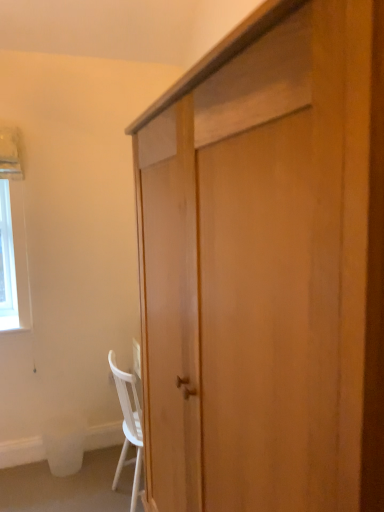
Identify the location of white plastic trash bin at lower left. (64, 444).

Where is `light wood cabinet at center`? light wood cabinet at center is located at coordinates (267, 268).

Image resolution: width=384 pixels, height=512 pixels. I want to click on white matte chair at lower left, so click(x=128, y=425).

Is white plastic trash bin at lower left completely or partially inside light wood cabinet at center?

No, white plastic trash bin at lower left is not surrounded by light wood cabinet at center.

Is light wood cabinet at center in contact with white plastic trash bin at lower left?

light wood cabinet at center and white plastic trash bin at lower left are not in contact.

Is light wood cabinet at center at the left side of white plastic trash bin at lower left?

In fact, light wood cabinet at center is to the right of white plastic trash bin at lower left.

From a real-world perspective, is light wood cabinet at center physically located above or below white plastic trash bin at lower left?

From a real-world perspective, light wood cabinet at center is physically above white plastic trash bin at lower left.

Are white matte chair at lower left and white plastic trash bin at lower left far apart?

No, there isn't a large distance between white matte chair at lower left and white plastic trash bin at lower left.

Considering the sizes of objects white matte chair at lower left and white plastic trash bin at lower left in the image provided, who is bigger, white matte chair at lower left or white plastic trash bin at lower left?

white matte chair at lower left is bigger.

From a real-world perspective, which object stands above the other?

white matte chair at lower left, from a real-world perspective.

In the scene shown: Considering their positions, is white matte chair at lower left located in front of or behind white plastic trash bin at lower left?

white matte chair at lower left is positioned closer to the viewer than white plastic trash bin at lower left.

From a real-world perspective, between white plastic trash bin at lower left and white matte chair at lower left, who is vertically lower?

white plastic trash bin at lower left is physically lower.

Based on the photo, does white plastic trash bin at lower left appear on the right side of white matte chair at lower left?

Incorrect, white plastic trash bin at lower left is not on the right side of white matte chair at lower left.

Could white matte chair at lower left be considered to be inside white plastic trash bin at lower left?

No, white matte chair at lower left is located outside of white plastic trash bin at lower left.

Considering the sizes of objects white plastic trash bin at lower left and white matte chair at lower left in the image provided, who is wider, white plastic trash bin at lower left or white matte chair at lower left?

Wider between the two is white plastic trash bin at lower left.

Which of these two, white matte chair at lower left or light wood cabinet at center, stands taller?

light wood cabinet at center.

Could you tell me if white matte chair at lower left is facing light wood cabinet at center?

No, white matte chair at lower left is not aimed at light wood cabinet at center.

Which object is closer to the camera, white matte chair at lower left or light wood cabinet at center?

light wood cabinet at center.

Considering the sizes of objects light wood cabinet at center and white matte chair at lower left in the image provided, who is bigger, light wood cabinet at center or white matte chair at lower left?

light wood cabinet at center.

This screenshot has height=512, width=384. In the image, there is a white matte chair at lower left. Identify the location of cabinetry above it (from the image's perspective). (267, 268).

Is light wood cabinet at center touching white matte chair at lower left?

No, light wood cabinet at center is not in contact with white matte chair at lower left.

Considering the relative positions of light wood cabinet at center and white matte chair at lower left in the image provided, is light wood cabinet at center to the left or to the right of white matte chair at lower left?

light wood cabinet at center is to the right of white matte chair at lower left.

From the image's perspective, would you say white plastic trash bin at lower left is shown under light wood cabinet at center?

Correct, white plastic trash bin at lower left appears lower than light wood cabinet at center in the image.

Consider the image. Is white plastic trash bin at lower left taller or shorter than light wood cabinet at center?

white plastic trash bin at lower left is shorter than light wood cabinet at center.

This screenshot has height=512, width=384. Find the location of `trash bin/can on the left of the light wood cabinet at center`. trash bin/can on the left of the light wood cabinet at center is located at coordinates (64, 444).

Locate an element on the screen. Image resolution: width=384 pixels, height=512 pixels. trash bin/can that appears below the white matte chair at lower left (from the image's perspective) is located at coordinates (64, 444).

Which object lies further to the anchor point white matte chair at lower left, white plastic trash bin at lower left or light wood cabinet at center?

light wood cabinet at center is further to white matte chair at lower left.

Which object lies further to the anchor point white matte chair at lower left, light wood cabinet at center or white plastic trash bin at lower left?

light wood cabinet at center is further to white matte chair at lower left.

Based on their spatial positions, is white plastic trash bin at lower left or white matte chair at lower left closer to light wood cabinet at center?

white matte chair at lower left lies closer to light wood cabinet at center than the other object.

From the image, which object appears to be nearer to white plastic trash bin at lower left, white matte chair at lower left or light wood cabinet at center?

The object closer to white plastic trash bin at lower left is white matte chair at lower left.

From the image, which object appears to be farther from light wood cabinet at center, white matte chair at lower left or white plastic trash bin at lower left?

Among the two, white plastic trash bin at lower left is located further to light wood cabinet at center.

Which object lies further to the anchor point white plastic trash bin at lower left, light wood cabinet at center or white matte chair at lower left?

light wood cabinet at center lies further to white plastic trash bin at lower left than the other object.

Image resolution: width=384 pixels, height=512 pixels. What are the coordinates of `chair between light wood cabinet at center and white plastic trash bin at lower left along the z-axis` in the screenshot? It's located at (128, 425).